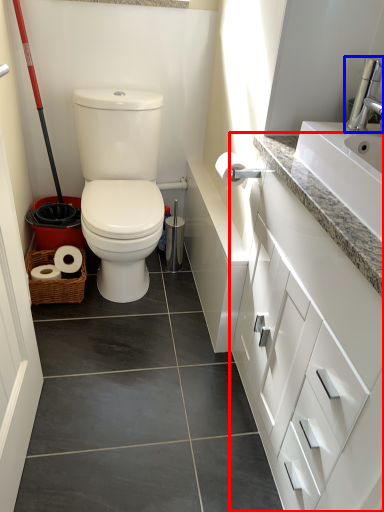
Question: Which point is further to the camera, bathroom cabinet (highlighted by a red box) or faucet (highlighted by a blue box)?

Choices:
 (A) bathroom cabinet
 (B) faucet

Answer: (B)